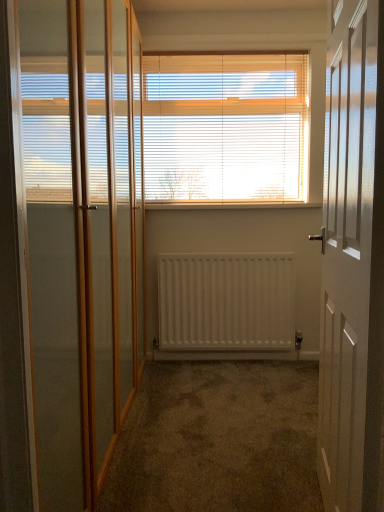
Locate an element on the screen. Image resolution: width=384 pixels, height=512 pixels. blank space situated above white wood blinds at center (from a real-world perspective) is located at coordinates (221, 51).